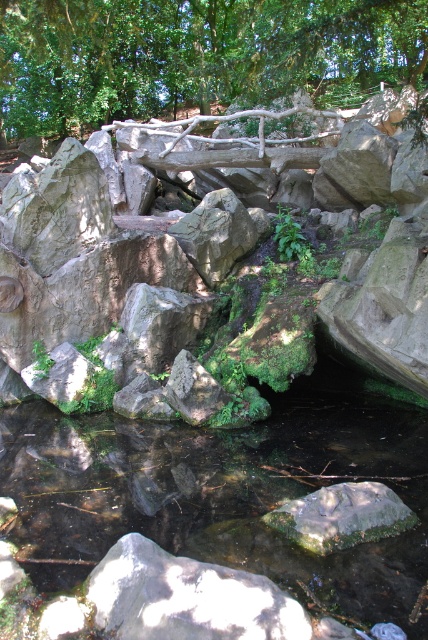
You are standing at the point marked as point (47, 522) in the image. You want to cross the wooden bridge to reach the other side of the water body. The bridge is 15 feet long. Can you safely walk across the bridge to the other side?

The distance between you and the viewer is 14.72 feet, which is slightly less than the bridge length of 15 feet. Therefore, the bridge is long enough for you to safely cross to the other side.

Based on the photo, you are a hiker who wants to cross the wooden bridge in the scene. You need to know if the rough gray rock at center is taller than the clear water at center to plan your path. Can you confirm this?

The rough gray rock at center is taller than the clear water at center, so yes, the rock is taller than the water.